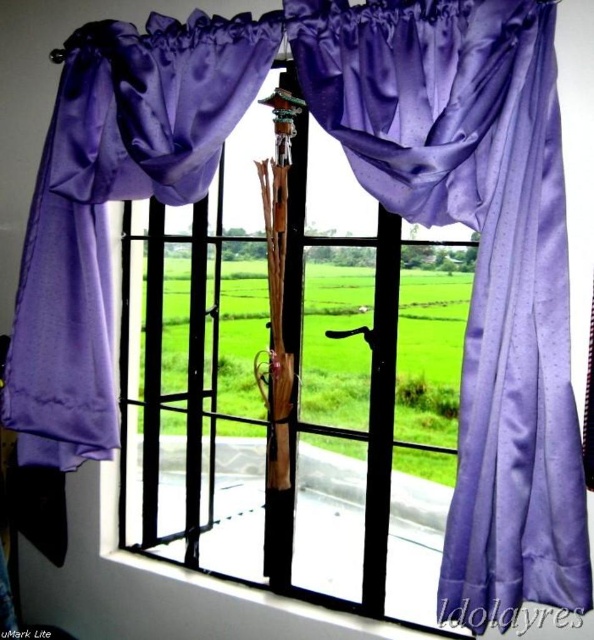
Does point (374, 467) come behind point (526, 204)?

Yes.

This screenshot has width=594, height=640. What do you see at coordinates (293, 385) in the screenshot?
I see `satin purple umbrella at center` at bounding box center [293, 385].

Where is `satin purple umbrella at center`? This screenshot has width=594, height=640. satin purple umbrella at center is located at coordinates (293, 385).

Is satin purple curtain at center to the right of satin purple curtain at left from the viewer's perspective?

Correct, you'll find satin purple curtain at center to the right of satin purple curtain at left.

Who is positioned more to the right, satin purple curtain at center or satin purple curtain at left?

satin purple curtain at center is more to the right.

This screenshot has width=594, height=640. I want to click on satin purple curtain at center, so click(x=476, y=262).

Who is more distant from viewer, (x=387, y=275) or (x=191, y=182)?

Point (x=191, y=182)

Image resolution: width=594 pixels, height=640 pixels. I want to click on satin purple umbrella at center, so click(293, 385).